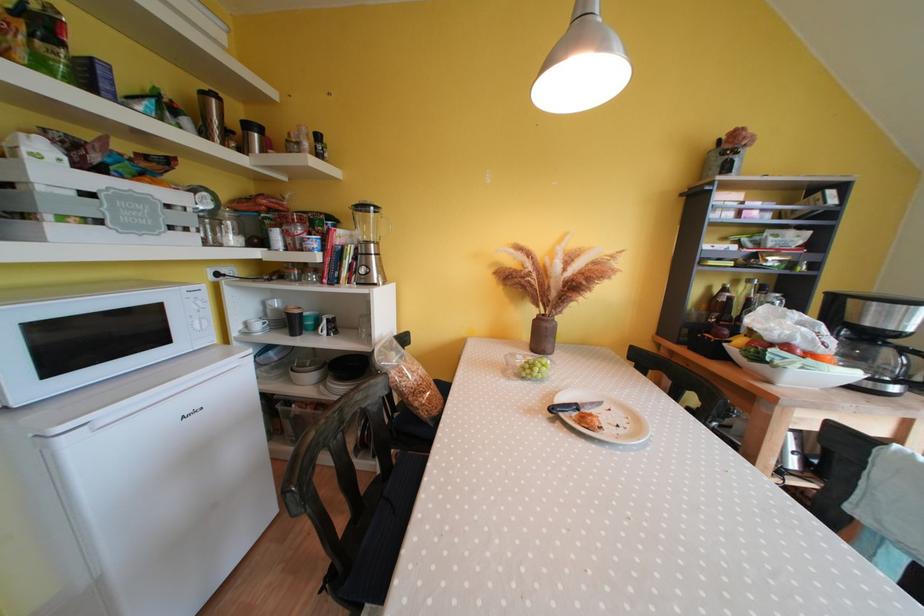
Find where to lift the white crate handle. Please return your answer as a coordinate pair (x, y).

(90, 208)